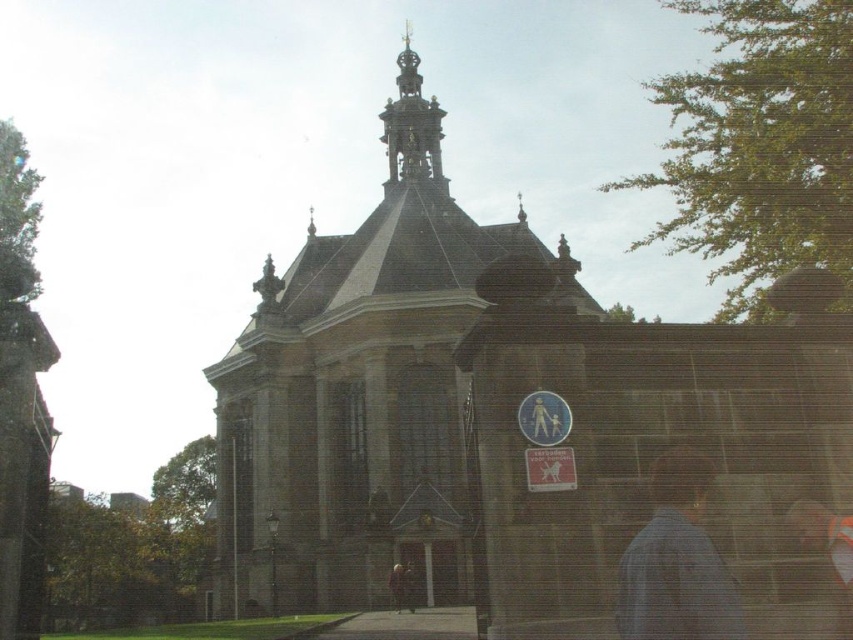
Is dark gray stone chapel at center shorter than blue denim jacket at lower right?

Incorrect, dark gray stone chapel at center's height does not fall short of blue denim jacket at lower right's.

Which of these two, dark gray stone chapel at center or blue denim jacket at lower right, stands shorter?

With less height is blue denim jacket at lower right.

The width and height of the screenshot is (853, 640). In order to click on dark gray stone chapel at center in this screenshot , I will do `click(363, 394)`.

Is gold ornate spire at upper center wider than light brown leather jacket at center?

Yes.

Which is behind, point (392, 109) or point (399, 570)?

Point (392, 109)

Does point (436, 118) come closer to viewer compared to point (396, 611)?

That is False.

Find the location of `gold ornate spire at upper center`. gold ornate spire at upper center is located at coordinates [412, 125].

Which is in front, point (641, 612) or point (399, 570)?

Point (641, 612)

Which of these two, blue denim jacket at lower right or light brown leather jacket at center, stands shorter?

light brown leather jacket at center is shorter.

Which is in front, point (706, 580) or point (392, 602)?

Point (706, 580)

Image resolution: width=853 pixels, height=640 pixels. I want to click on blue denim jacket at lower right, so click(676, 563).